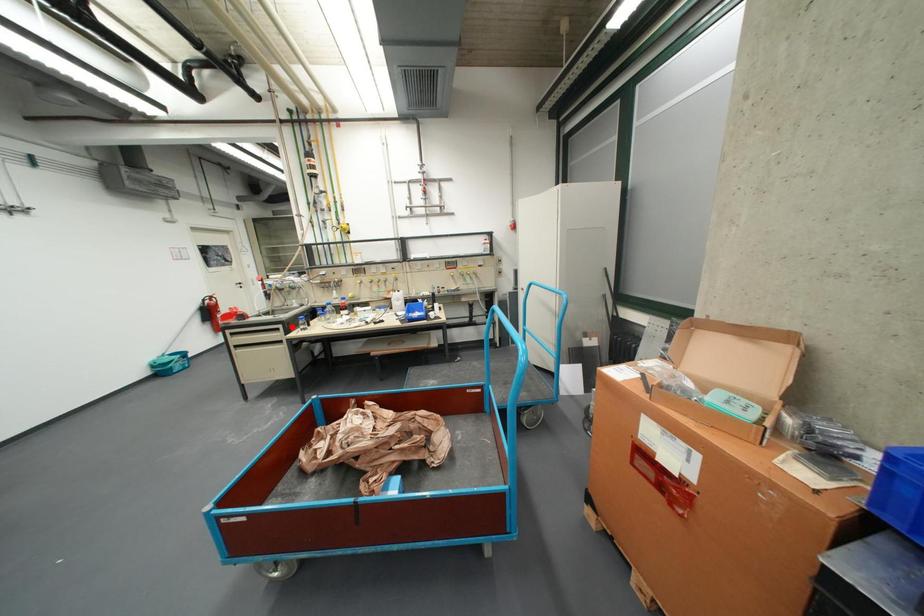
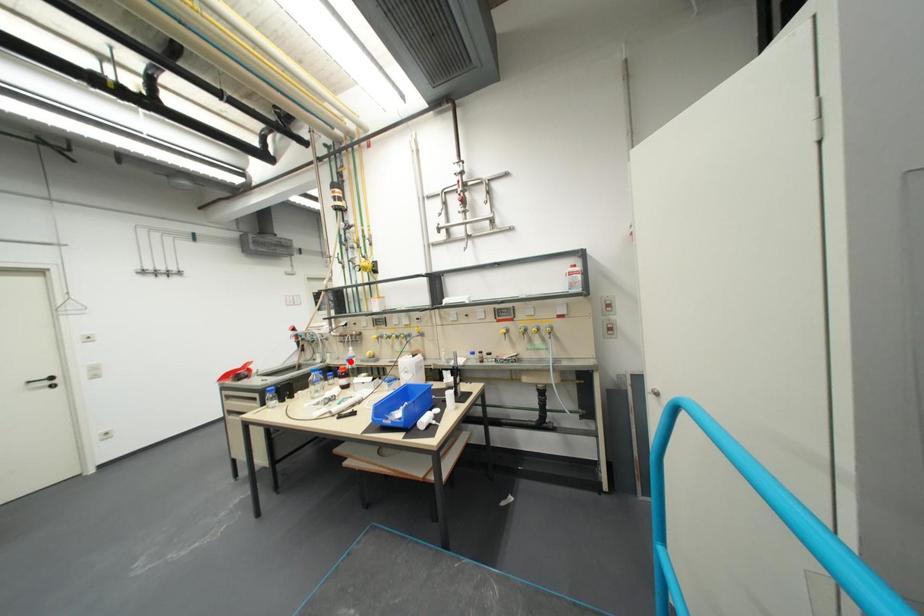
I am providing you with two images of the same scene from different viewpoints. A red point is marked on the first image and another point is marked on the second image. Do the highlighted points in image1 and image2 indicate the same real-world spot?

No